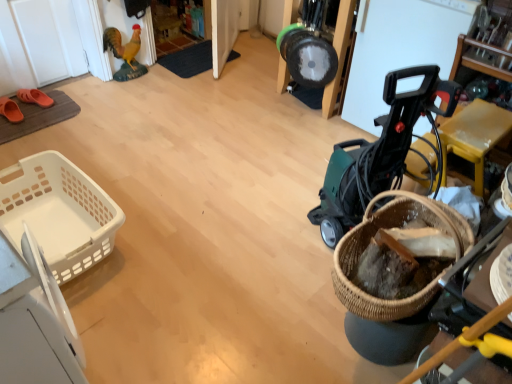
Find the location of a particular element. This screenshot has width=512, height=384. free point in front of orange rubber sandals at left, the second footwear in the back-to-front sequence is located at coordinates (8, 132).